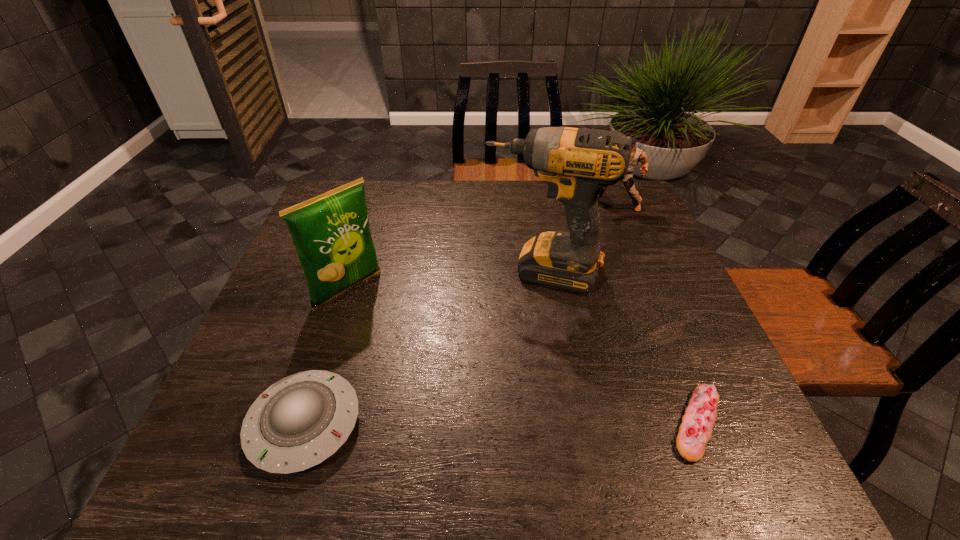
Image resolution: width=960 pixels, height=540 pixels. What are the coordinates of `eclair that is positioned at the near edge` in the screenshot? It's located at click(695, 431).

Where is `saucer present at the left edge`? saucer present at the left edge is located at coordinates (300, 421).

At what (x,y) coordinates should I click in order to perform the action: click on crisp (potato chip) that is at the left edge. Please return your answer as a coordinate pair (x, y). Looking at the image, I should click on (331, 234).

The image size is (960, 540). Find the location of `eclair that is at the right edge`. eclair that is at the right edge is located at coordinates (695, 431).

This screenshot has height=540, width=960. I want to click on puncher at the right edge, so click(x=637, y=155).

The image size is (960, 540). Identify the location of object present at the near left corner. (300, 421).

Where is `object located in the far right corner section of the desktop`? This screenshot has width=960, height=540. object located in the far right corner section of the desktop is located at coordinates (x=637, y=155).

Locate an element on the screen. The width and height of the screenshot is (960, 540). object located in the near right corner section of the desktop is located at coordinates (695, 431).

What are the coordinates of `vacant space at the far edge of the desktop` in the screenshot? It's located at (468, 202).

Image resolution: width=960 pixels, height=540 pixels. In the image, there is a desktop. What are the coordinates of `vacant region at the near edge` in the screenshot? It's located at (472, 421).